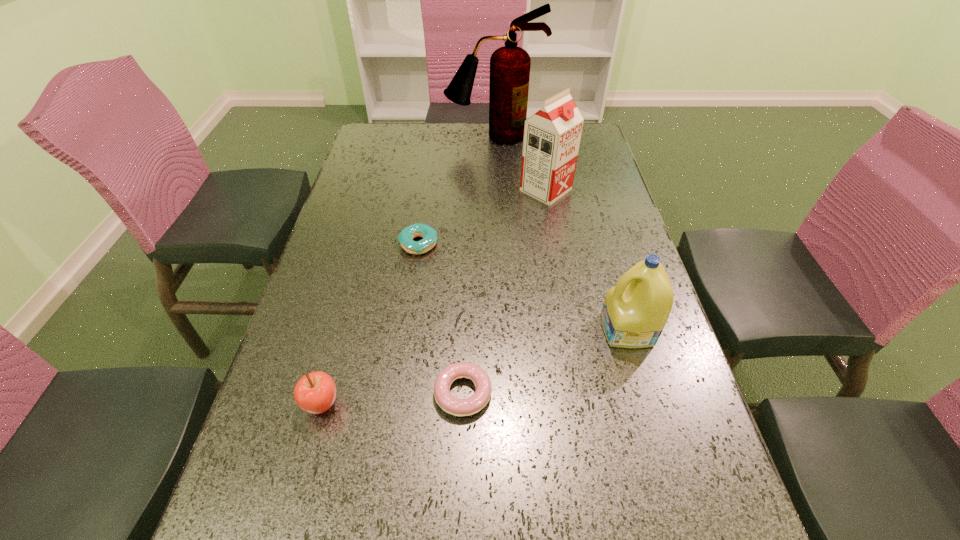
Image resolution: width=960 pixels, height=540 pixels. In order to click on unoccupied area between the fourth tallest object and the nearer doughnut in this screenshot , I will do `click(393, 399)`.

Image resolution: width=960 pixels, height=540 pixels. I want to click on vacant space that is in between the fifth shortest object and the fourth shortest object, so click(587, 260).

Locate an element on the screen. This screenshot has height=540, width=960. free point between the fourth nearest object and the second tallest object is located at coordinates (482, 217).

The width and height of the screenshot is (960, 540). In order to click on free space between the detergent and the fifth nearest object in this screenshot , I will do `click(587, 260)`.

The image size is (960, 540). Find the location of `free spot between the soya milk and the farthest object`. free spot between the soya milk and the farthest object is located at coordinates (519, 164).

Where is `object identified as the fourth closest to the third shortest object`? object identified as the fourth closest to the third shortest object is located at coordinates (552, 135).

Identify which object is the third closest to the tallest object. Please provide its 2D coordinates. Your answer should be formatted as a tuple, i.e. [(x, y)], where the tuple contains the x and y coordinates of a point satisfying the conditions above.

[(635, 311)]